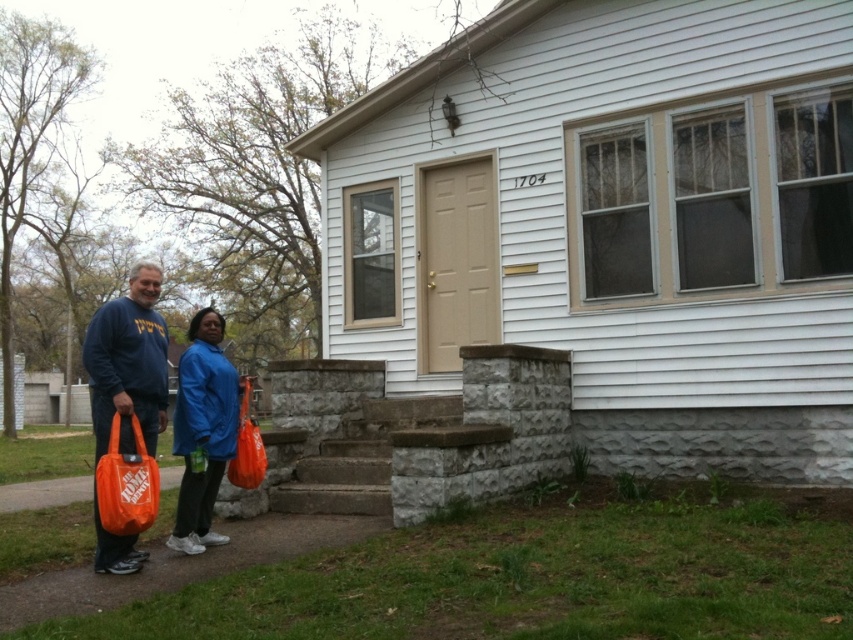
From the picture: Does matte blue sweatshirt at left appear over orange plastic bag at lower left?

Incorrect, matte blue sweatshirt at left is not positioned above orange plastic bag at lower left.

Which is in front, point (106, 307) or point (134, 465)?

Positioned in front is point (134, 465).

Is point (111, 419) positioned after point (149, 458)?

Yes, point (111, 419) is behind point (149, 458).

What are the coordinates of `matte blue sweatshirt at left` in the screenshot? It's located at (128, 364).

Which of these two, blue fabric jacket at lower left or orange plastic bag at lower left, stands taller?

orange plastic bag at lower left

How far apart are blue fabric jacket at lower left and orange plastic bag at lower left?

blue fabric jacket at lower left and orange plastic bag at lower left are 28.90 inches apart.

Who is more distant from viewer, (207, 435) or (141, 512)?

The point (207, 435) is behind.

At what (x,y) coordinates should I click in order to perform the action: click on blue fabric jacket at lower left. Please return your answer as a coordinate pair (x, y). The width and height of the screenshot is (853, 640). Looking at the image, I should click on (202, 429).

Does point (120, 424) come behind point (190, 380)?

No, (120, 424) is in front of (190, 380).

In the scene shown: Between matte blue sweatshirt at left and blue fabric jacket at lower left, which one has more height?

matte blue sweatshirt at left is taller.

Describe the element at coordinates (128, 364) in the screenshot. I see `matte blue sweatshirt at left` at that location.

This screenshot has height=640, width=853. What are the coordinates of `matte blue sweatshirt at left` in the screenshot? It's located at (128, 364).